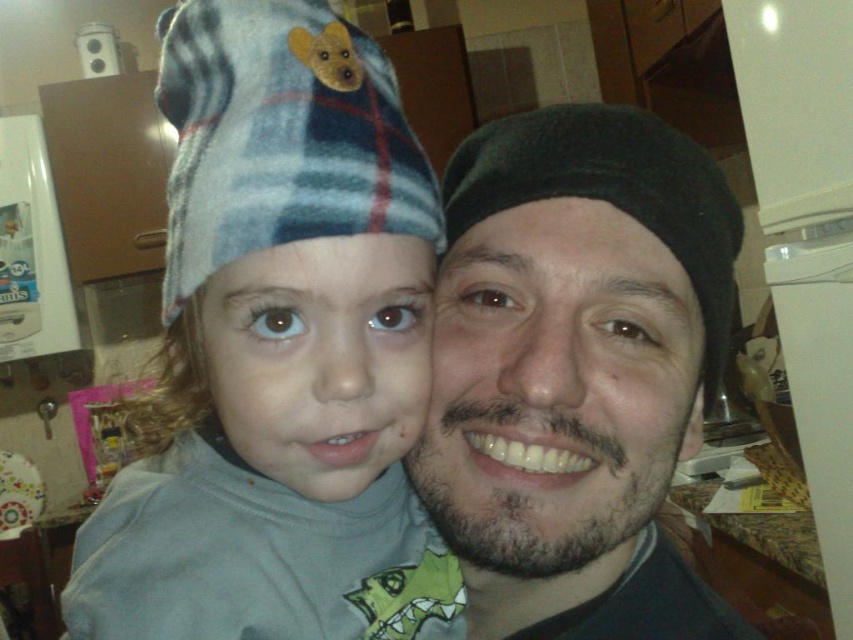
You are a photographer setting up a shoot in the kitchen. You have to decide which object to focus on first between the black matte beret at center and the plaid flannel hat at upper left. Which one is closer to you?

The black matte beret at center is closer to you than the plaid flannel hat at upper left because it is further to the viewer.

You are trying to decide which hat to wear for a casual day out. Based on the image, which hat is taller between the fluffy fleece hat at upper left and the black matte beret at center?

The fluffy fleece hat at upper left is taller than the black matte beret at center according to the description.